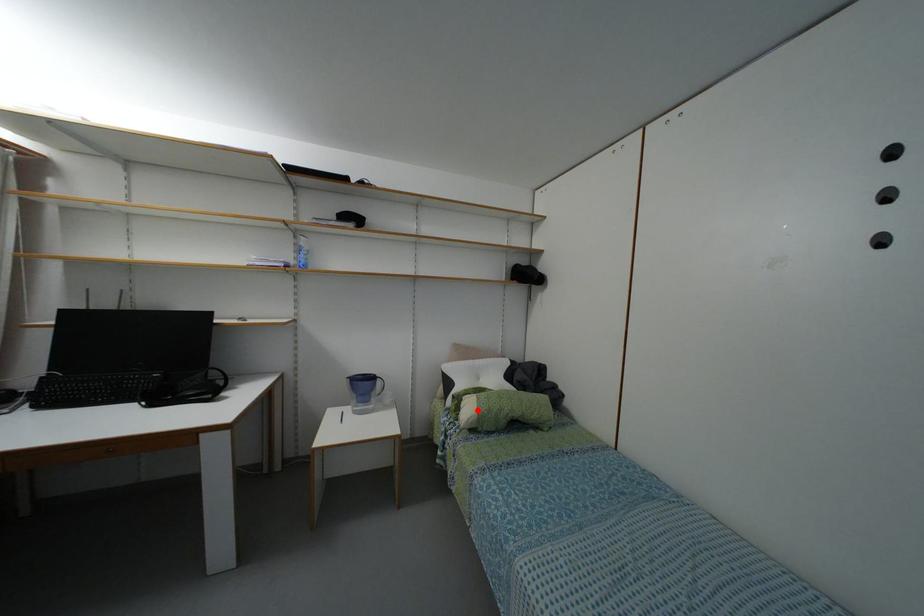
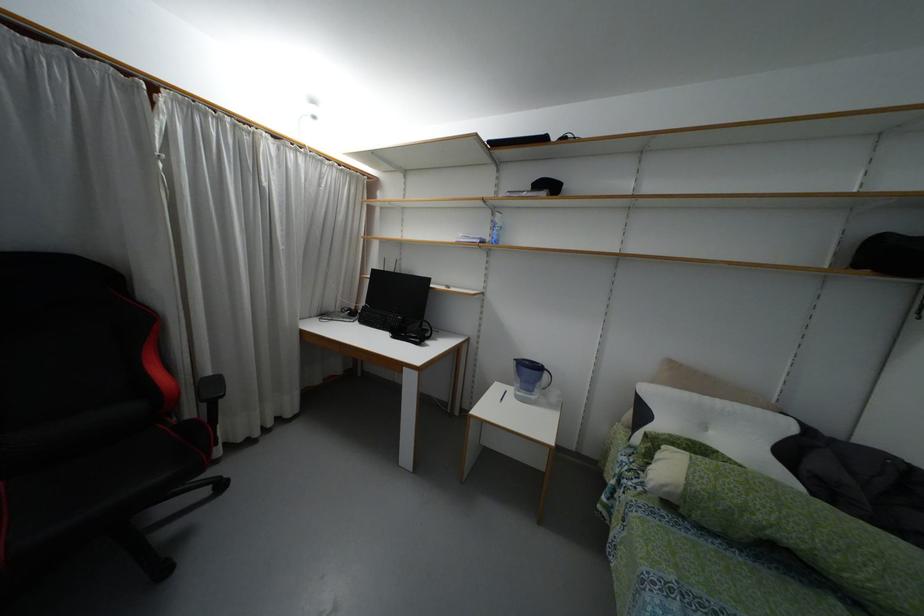
Locate, in the second image, the point that corresponds to the highlighted location in the first image.

(687, 483)